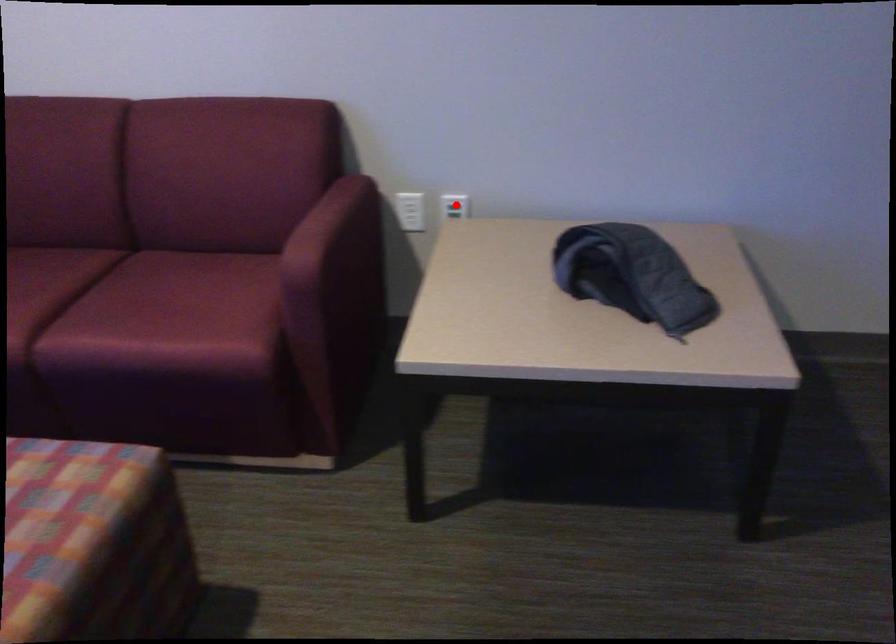
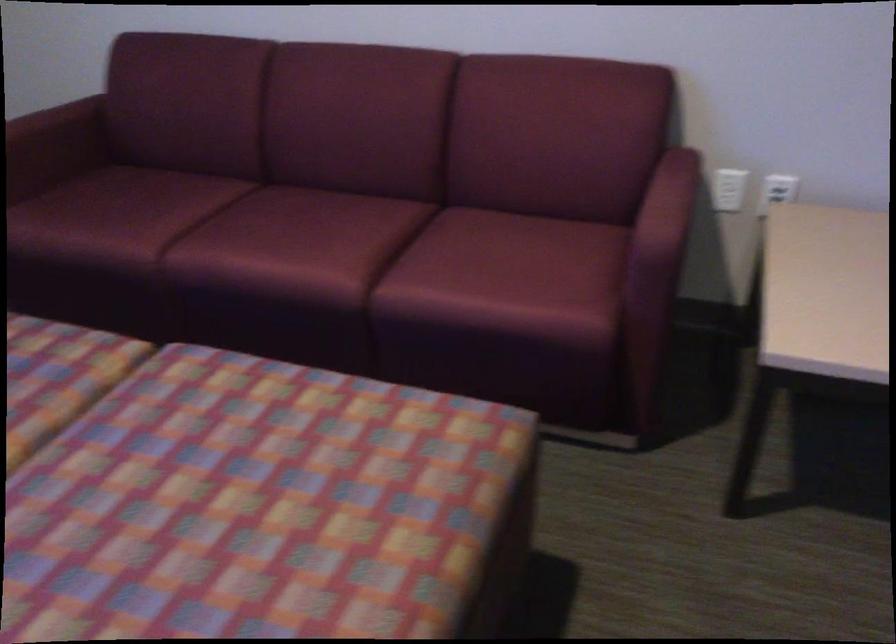
Find the pixel in the second image that matches the highlighted location in the first image.

(777, 190)